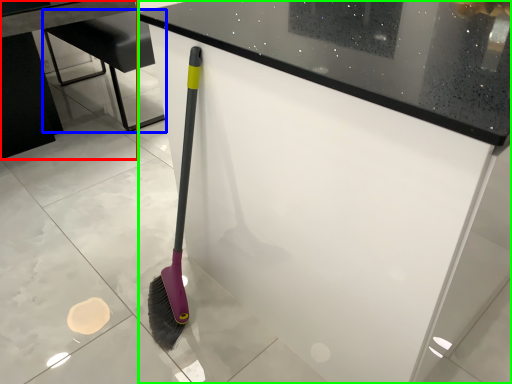
Question: Considering the real-world distances, which object is closest to table (highlighted by a red box)? furniture (highlighted by a blue box) or counter (highlighted by a green box).

Choices:
 (A) furniture
 (B) counter

Answer: (A)